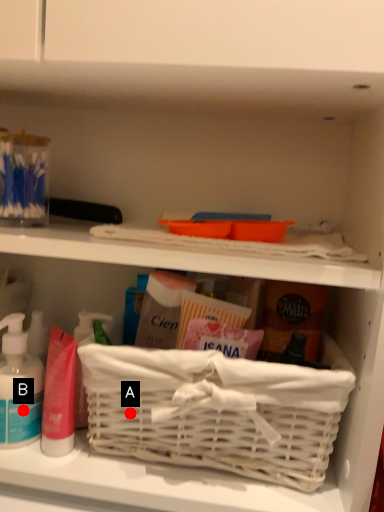
Question: Two points are circled on the image, labeled by A and B beside each circle. Which point is closer to the camera taking this photo?

Choices:
 (A) A is closer
 (B) B is closer

Answer: (A)